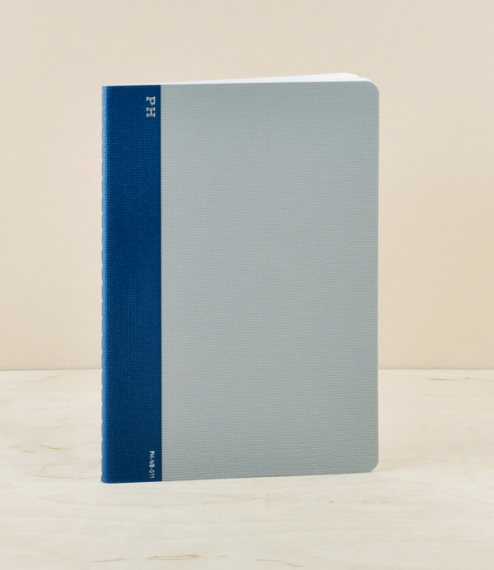
Image resolution: width=494 pixels, height=570 pixels. What are the coordinates of `blue colored edge of book` in the screenshot? It's located at (140, 357).